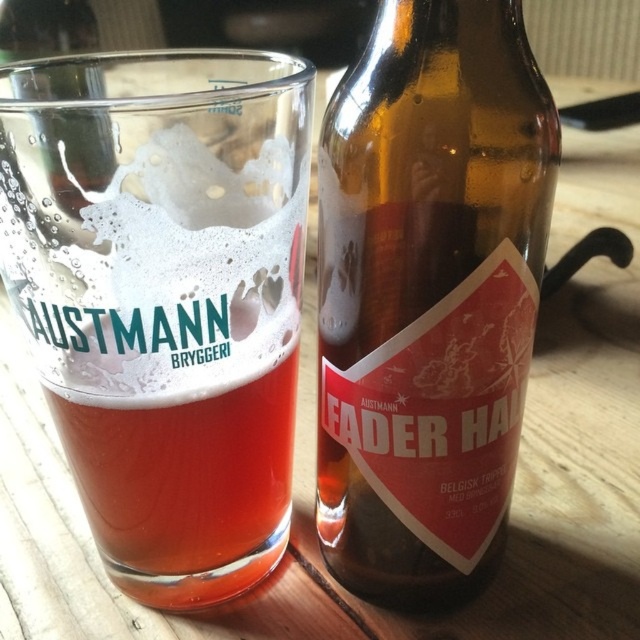
Is brown glass bottle at right closer to camera compared to transparent glass bottle at center?

Yes, brown glass bottle at right is in front of transparent glass bottle at center.

Is brown glass bottle at right smaller than transparent glass bottle at center?

No, brown glass bottle at right is not smaller than transparent glass bottle at center.

Between point (460, 211) and point (3, 48), which one is positioned behind?

The point (3, 48) is more distant.

The image size is (640, 640). Find the location of `brown glass bottle at right`. brown glass bottle at right is located at coordinates (428, 291).

Between clear glass beer at center and brown glass bottle at right, which one has more height?

Standing taller between the two is clear glass beer at center.

How far apart are clear glass beer at center and brown glass bottle at right?

They are 4.17 inches apart.

What do you see at coordinates (164, 298) in the screenshot? I see `clear glass beer at center` at bounding box center [164, 298].

At what (x,y) coordinates should I click in order to perform the action: click on clear glass beer at center. Please return your answer as a coordinate pair (x, y). This screenshot has width=640, height=640. Looking at the image, I should click on (164, 298).

Who is positioned more to the left, clear glass beer at center or transparent glass bottle at center?

transparent glass bottle at center is more to the left.

Does clear glass beer at center appear on the right side of transparent glass bottle at center?

Correct, you'll find clear glass beer at center to the right of transparent glass bottle at center.

Between point (96, 179) and point (93, 65), which one is positioned in front?

Point (96, 179) is in front.

Identify the location of clear glass beer at center. [164, 298].